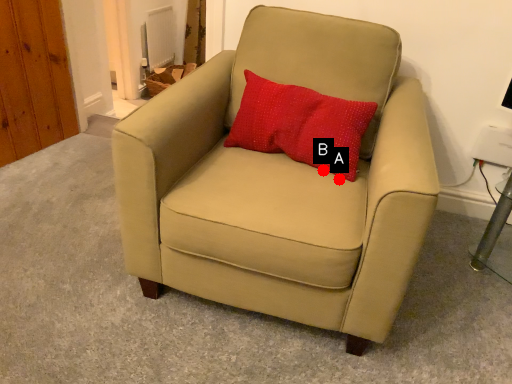
Question: Two points are circled on the image, labeled by A and B beside each circle. Which point is farther to the camera?

Choices:
 (A) A is further
 (B) B is further

Answer: (B)